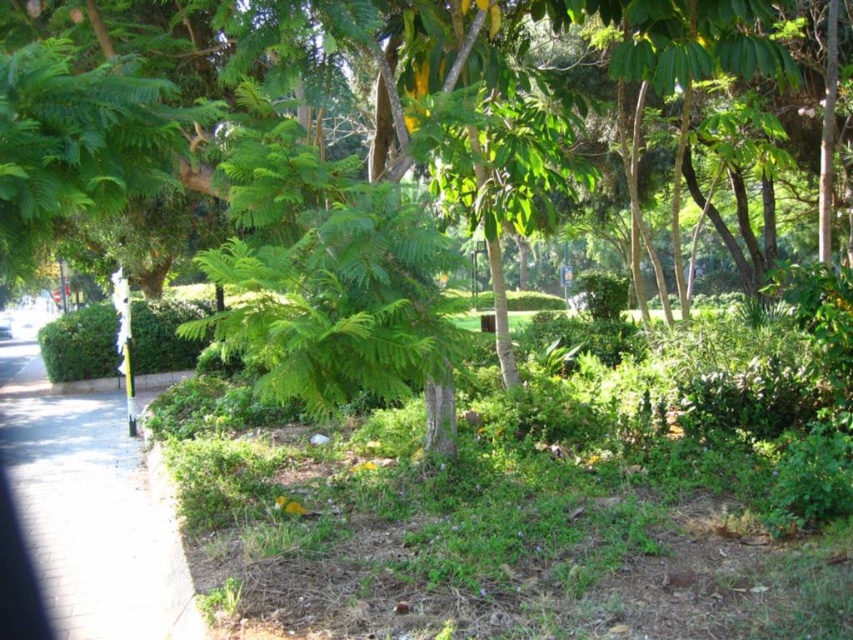
Looking at this image, you are a gardener who needs to water both the green leafy grass at center and the green leafy bush at center. If your watering can has a range of 40 feet, can you water both plants without moving the can?

The green leafy grass at center is 40.26 feet from the green leafy bush at center. Since the distance between them exceeds the watering can range of 40 feet, you cannot water both plants without moving the can.

You are standing in the park and want to reach a specific point marked as point [689,515]. If you can walk 10 feet per minute, how many minutes will it take you to reach that point?

The distance between you and point [689,515] is 16.65 feet. At a walking speed of 10 feet per minute, it would take approximately 1.665 minutes to reach the point.